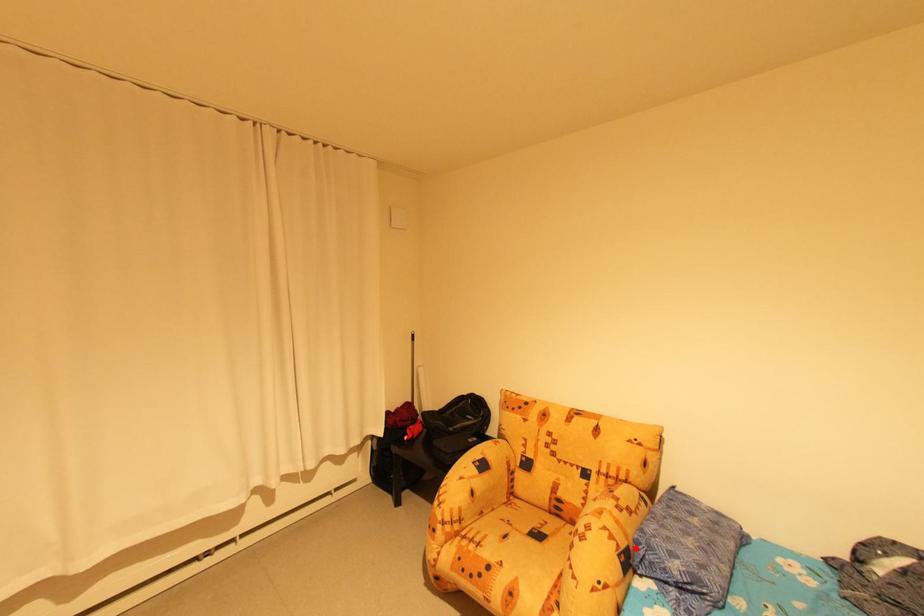
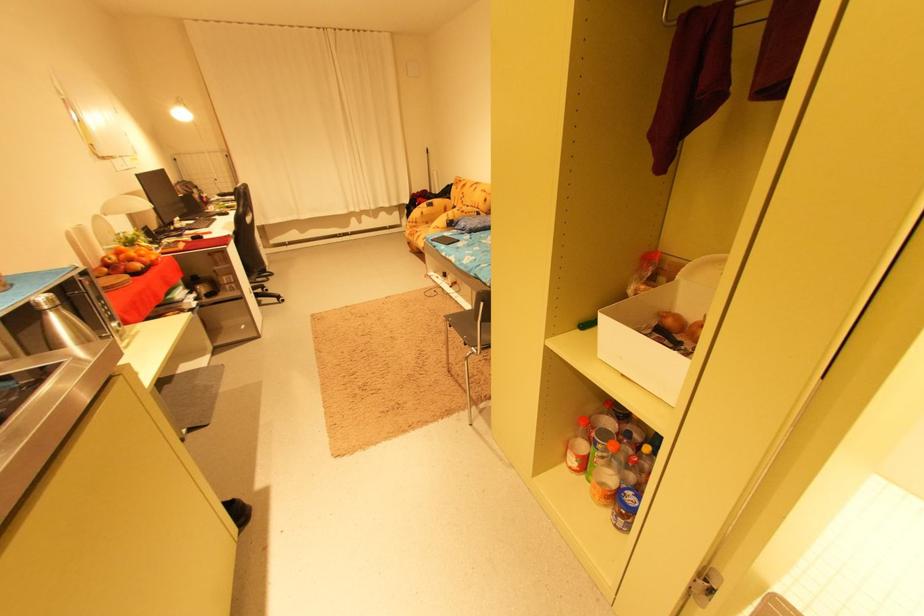
Find the pixel in the second image that matches the highlighted location in the first image.

(459, 221)